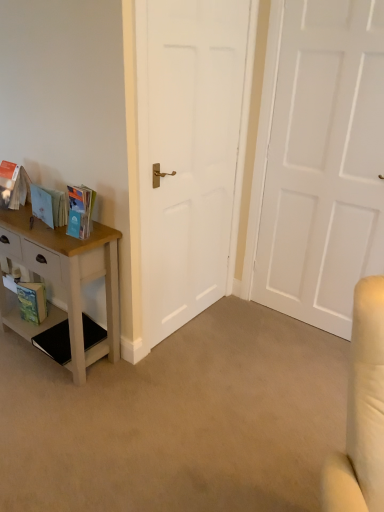
Locate an element on the screen. The height and width of the screenshot is (512, 384). free space in front of matte orange book at left, positioned as the first book in left-to-right order is located at coordinates (17, 220).